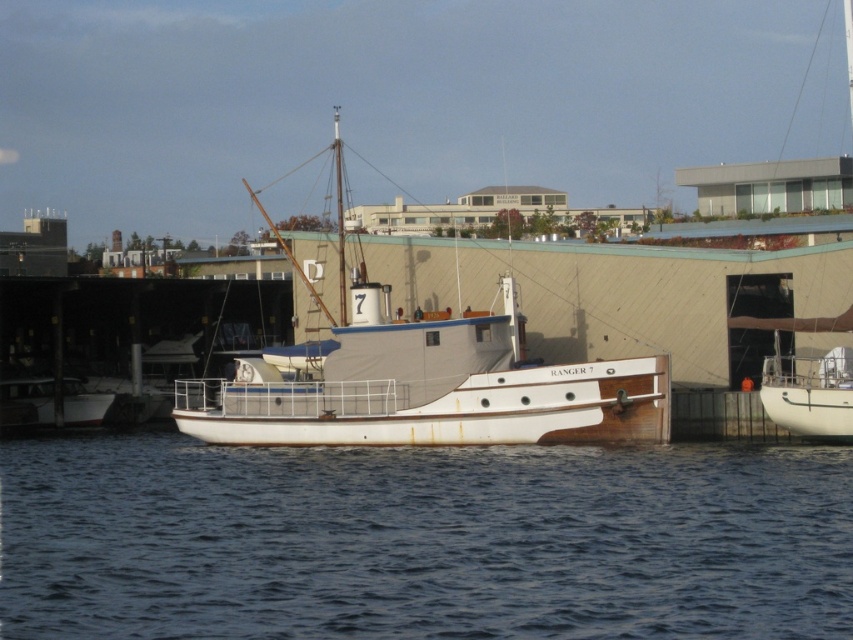
You are standing at the point with coordinates (426, 385) in the image. What object are you standing on?

You are standing on the white wood boat at center, which is represented by the point with coordinates (426, 385).